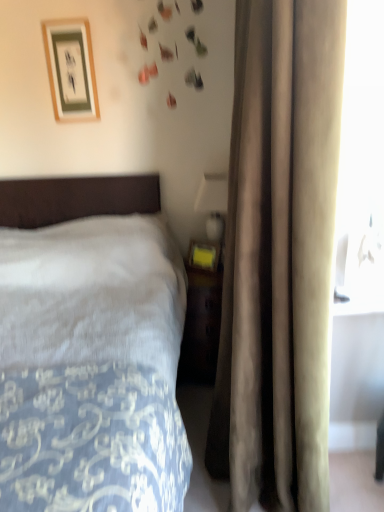
Question: Would you say beige velvet curtain at right is to the left or to the right of matte gold picture frame at upper left in the picture?

Choices:
 (A) right
 (B) left

Answer: (A)

Question: Is beige velvet curtain at right wider or thinner than matte gold picture frame at upper left?

Choices:
 (A) wide
 (B) thin

Answer: (A)

Question: Which is nearer to the beige velvet curtain at right?

Choices:
 (A) matte gold picture frame at upper left
 (B) matte yellow plastic at right
 (C) white soft bed at left

Answer: (C)

Question: Based on their relative distances, which object is farther from the matte yellow plastic at right?

Choices:
 (A) matte gold picture frame at upper left
 (B) beige velvet curtain at right
 (C) white soft bed at left

Answer: (C)